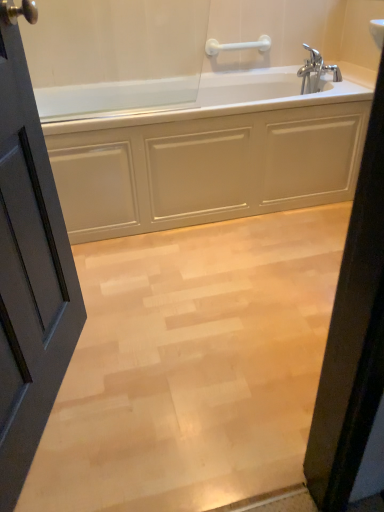
What do you see at coordinates (237, 45) in the screenshot? The image size is (384, 512). I see `white plastic towel bar at upper center` at bounding box center [237, 45].

The image size is (384, 512). Describe the element at coordinates (316, 70) in the screenshot. I see `chrome metallic faucet at upper right` at that location.

At what (x,y) coordinates should I click in order to perform the action: click on white plastic towel bar at upper center. Please return your answer as a coordinate pair (x, y). The width and height of the screenshot is (384, 512). Looking at the image, I should click on (237, 45).

Considering the points (115, 203) and (337, 234), which point is in front, point (115, 203) or point (337, 234)?

The point (115, 203) is closer.

Based on the photo, considering the positions of objects white glossy bathtub at center and light wood floor at center in the image provided, who is more to the right, white glossy bathtub at center or light wood floor at center?

light wood floor at center.

This screenshot has width=384, height=512. What are the coordinates of `plain in front of the white glossy bathtub at center` in the screenshot? It's located at (192, 366).

Is white glossy bathtub at center turned away from light wood floor at center?

No, white glossy bathtub at center is not facing the opposite direction of light wood floor at center.

Is white glossy bathtub at center inside matte gray door at left?

Definitely not — white glossy bathtub at center is not inside matte gray door at left.

Which of these two, matte gray door at left or white glossy bathtub at center, is wider?

With larger width is white glossy bathtub at center.

Is point (8, 263) farther from camera compared to point (161, 217)?

No.

Is matte gray door at left to the left of white glossy bathtub at center from the viewer's perspective?

Indeed, matte gray door at left is positioned on the left side of white glossy bathtub at center.

Locate an element on the screen. plain below the white plastic towel bar at upper center (from a real-world perspective) is located at coordinates (192, 366).

Is light wood floor at center wider than white plastic towel bar at upper center?

Yes.

From the picture: Is light wood floor at center positioned beyond the bounds of white plastic towel bar at upper center?

Yes, light wood floor at center is outside of white plastic towel bar at upper center.

Consider the image. Does light wood floor at center have a smaller size compared to white plastic towel bar at upper center?

Actually, light wood floor at center might be larger than white plastic towel bar at upper center.

In the scene shown: From a real-world perspective, does chrome metallic faucet at upper right stand above white glossy bathtub at center?

Indeed, from a real-world perspective, chrome metallic faucet at upper right stands above white glossy bathtub at center.

Who is bigger, chrome metallic faucet at upper right or white glossy bathtub at center?

With larger size is white glossy bathtub at center.

Is chrome metallic faucet at upper right facing towards white glossy bathtub at center?

Yes, chrome metallic faucet at upper right is turned towards white glossy bathtub at center.

Between point (337, 73) and point (113, 169), which one is positioned behind?

The point (337, 73) is farther from the camera.

Which of these two, chrome metallic faucet at upper right or matte gray door at left, is bigger?

matte gray door at left.

Is chrome metallic faucet at upper right turned away from matte gray door at left?

No, chrome metallic faucet at upper right is not facing the opposite direction of matte gray door at left.

Consider the image. From their relative heights in the image, would you say chrome metallic faucet at upper right is taller or shorter than matte gray door at left?

Considering their sizes, chrome metallic faucet at upper right has less height than matte gray door at left.

Is matte gray door at left a part of chrome metallic faucet at upper right?

No, matte gray door at left is not surrounded by chrome metallic faucet at upper right.

Can chrome metallic faucet at upper right be found inside white plastic towel bar at upper center?

No, white plastic towel bar at upper center does not contain chrome metallic faucet at upper right.

In terms of size, does white plastic towel bar at upper center appear bigger or smaller than chrome metallic faucet at upper right?

Considering their sizes, white plastic towel bar at upper center takes up less space than chrome metallic faucet at upper right.

From the image's perspective, which is above, white plastic towel bar at upper center or chrome metallic faucet at upper right?

white plastic towel bar at upper center, from the image's perspective.

Between white plastic towel bar at upper center and chrome metallic faucet at upper right, which one appears on the left side from the viewer's perspective?

Positioned to the left is white plastic towel bar at upper center.

Looking at this image, is light wood floor at center not near matte gray door at left?

No, light wood floor at center is not far away from matte gray door at left.

How far apart are light wood floor at center and matte gray door at left?

light wood floor at center is 19.10 inches from matte gray door at left.

Looking at this image, how different are the orientations of light wood floor at center and matte gray door at left in degrees?

light wood floor at center and matte gray door at left are facing 71.9 degrees away from each other.

Could you tell me if light wood floor at center is facing matte gray door at left?

No, light wood floor at center is not turned towards matte gray door at left.

The height and width of the screenshot is (512, 384). In order to click on bathtub above the light wood floor at center (from a real-world perspective) in this screenshot , I will do `click(210, 156)`.

Locate an element on the screen. bathtub to the right of matte gray door at left is located at coordinates (210, 156).

When comparing their distances from white plastic towel bar at upper center, does matte gray door at left or light wood floor at center seem further?

The object further to white plastic towel bar at upper center is matte gray door at left.

When comparing their distances from white glossy bathtub at center, does chrome metallic faucet at upper right or light wood floor at center seem further?

The object further to white glossy bathtub at center is chrome metallic faucet at upper right.

Based on their spatial positions, is white plastic towel bar at upper center or white glossy bathtub at center closer to matte gray door at left?

white glossy bathtub at center is closer to matte gray door at left.

Looking at the image, which one is located closer to white plastic towel bar at upper center, chrome metallic faucet at upper right or white glossy bathtub at center?

chrome metallic faucet at upper right is closer to white plastic towel bar at upper center.

Based on their spatial positions, is white plastic towel bar at upper center or chrome metallic faucet at upper right further from white glossy bathtub at center?

white plastic towel bar at upper center.

Which object lies further to the anchor point chrome metallic faucet at upper right, matte gray door at left or white glossy bathtub at center?

matte gray door at left is further to chrome metallic faucet at upper right.

When comparing their distances from matte gray door at left, does white glossy bathtub at center or white plastic towel bar at upper center seem closer?

white glossy bathtub at center lies closer to matte gray door at left than the other object.

From the image, which object appears to be nearer to white plastic towel bar at upper center, light wood floor at center or chrome metallic faucet at upper right?

Based on the image, chrome metallic faucet at upper right appears to be nearer to white plastic towel bar at upper center.

Identify the location of bathtub between chrome metallic faucet at upper right and light wood floor at center in the up-down direction. (210, 156).

At what (x,y) coordinates should I click in order to perform the action: click on tap that lies between white plastic towel bar at upper center and light wood floor at center from top to bottom. Please return your answer as a coordinate pair (x, y). This screenshot has height=512, width=384. Looking at the image, I should click on (316, 70).

The image size is (384, 512). What are the coordinates of `bathtub between matte gray door at left and chrome metallic faucet at upper right from front to back` in the screenshot? It's located at (210, 156).

Where is `tap between white glossy bathtub at center and white plastic towel bar at upper center from front to back`? tap between white glossy bathtub at center and white plastic towel bar at upper center from front to back is located at coordinates (316, 70).